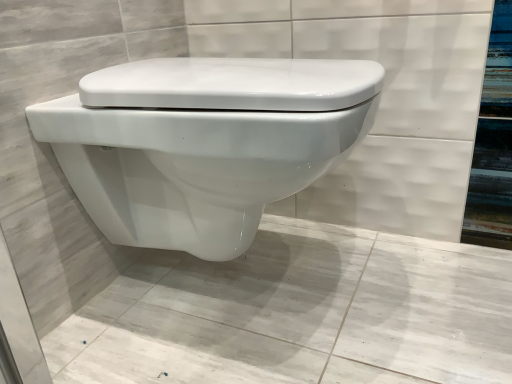
Question: Does white glossy toilet at center appear on the left side of white glossy toilet at center?

Choices:
 (A) no
 (B) yes

Answer: (A)

Question: From the image's perspective, is white glossy toilet at center above white glossy toilet at center?

Choices:
 (A) yes
 (B) no

Answer: (A)

Question: Is white glossy toilet at center surrounded by white glossy toilet at center?

Choices:
 (A) yes
 (B) no

Answer: (B)

Question: Is white glossy toilet at center looking in the opposite direction of white glossy toilet at center?

Choices:
 (A) yes
 (B) no

Answer: (B)

Question: Is white glossy toilet at center shorter than white glossy toilet at center?

Choices:
 (A) yes
 (B) no

Answer: (B)

Question: Does white glossy toilet at center come in front of white glossy toilet at center?

Choices:
 (A) yes
 (B) no

Answer: (B)

Question: From a real-world perspective, is white glossy toilet at center below white glossy toilet at center?

Choices:
 (A) no
 (B) yes

Answer: (B)

Question: Does white glossy toilet at center have a lesser height compared to white glossy toilet at center?

Choices:
 (A) yes
 (B) no

Answer: (A)

Question: Is white glossy toilet at center turned away from white glossy toilet at center?

Choices:
 (A) yes
 (B) no

Answer: (B)

Question: Is white glossy toilet at center far away from white glossy toilet at center?

Choices:
 (A) yes
 (B) no

Answer: (B)

Question: Does white glossy toilet at center come behind white glossy toilet at center?

Choices:
 (A) no
 (B) yes

Answer: (A)

Question: Is white glossy toilet at center next to white glossy toilet at center and touching it?

Choices:
 (A) no
 (B) yes

Answer: (A)

Question: Is white glossy toilet at center spatially inside white glossy toilet at center, or outside of it?

Choices:
 (A) inside
 (B) outside

Answer: (B)